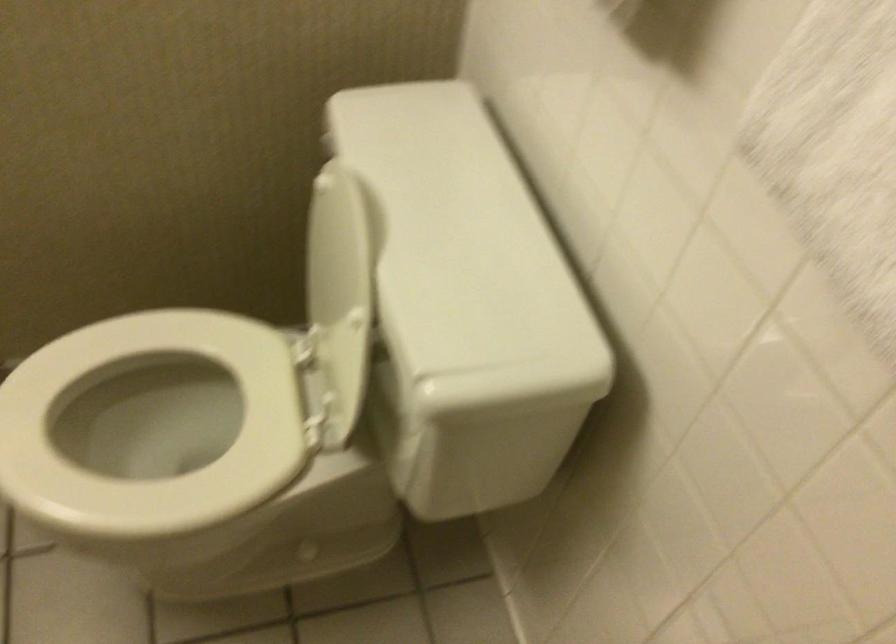
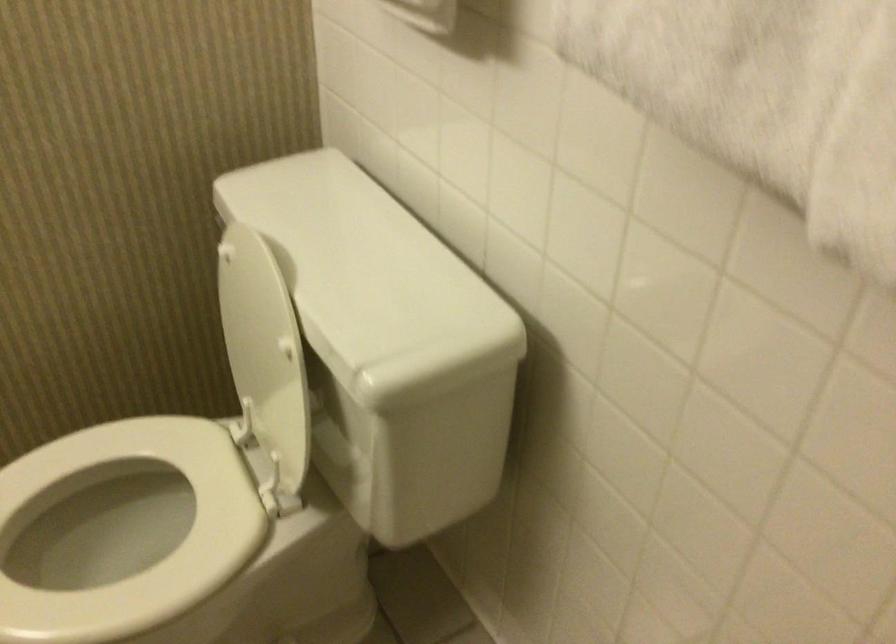
Locate, in the second image, the point that corresponds to the point at 145,422 in the first image.

(97, 545)